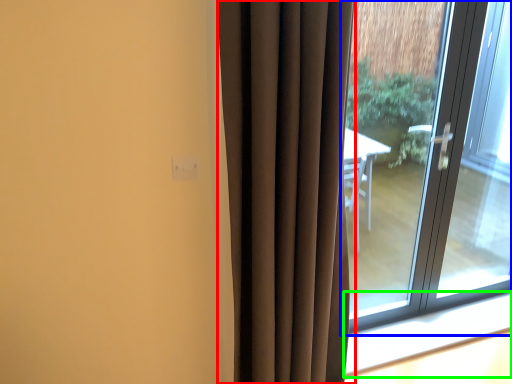
Question: Based on their relative distances, which object is farther from curtain (highlighted by a red box)? Choose from window (highlighted by a blue box) and window sill (highlighted by a green box).

Choices:
 (A) window
 (B) window sill

Answer: (B)